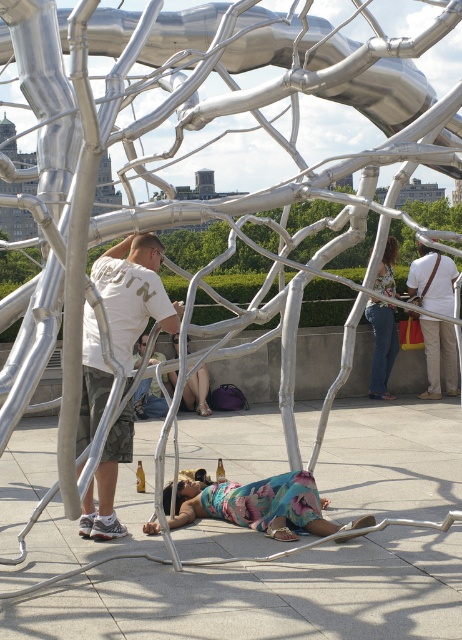
You are a photographer trying to capture the multicolored fabric at center and the matte white shirt at center in the same frame. Based on their heights, which object should you focus on first to ensure both are in focus?

The multicolored fabric at center is shorter than the matte white shirt at center, so you should focus on the matte white shirt at center first to ensure both are in focus.

You are a photographer trying to capture the multicolored fabric at center and the matte white shirt at center in your shot. Which object will appear narrower in the photo?

The multicolored fabric at center is thinner than the matte white shirt at center, so it will appear narrower in the photo.